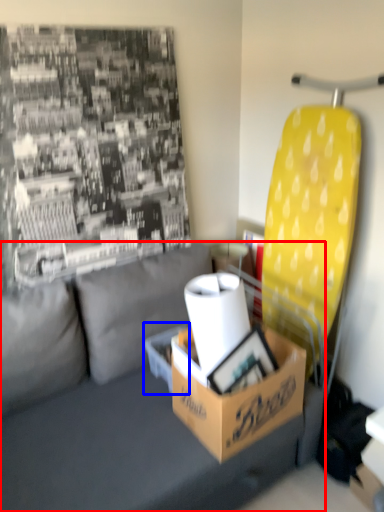
Question: Which object appears farthest to the camera in this image, studio couch (highlighted by a red box) or cardboard box (highlighted by a blue box)?

Choices:
 (A) studio couch
 (B) cardboard box

Answer: (B)